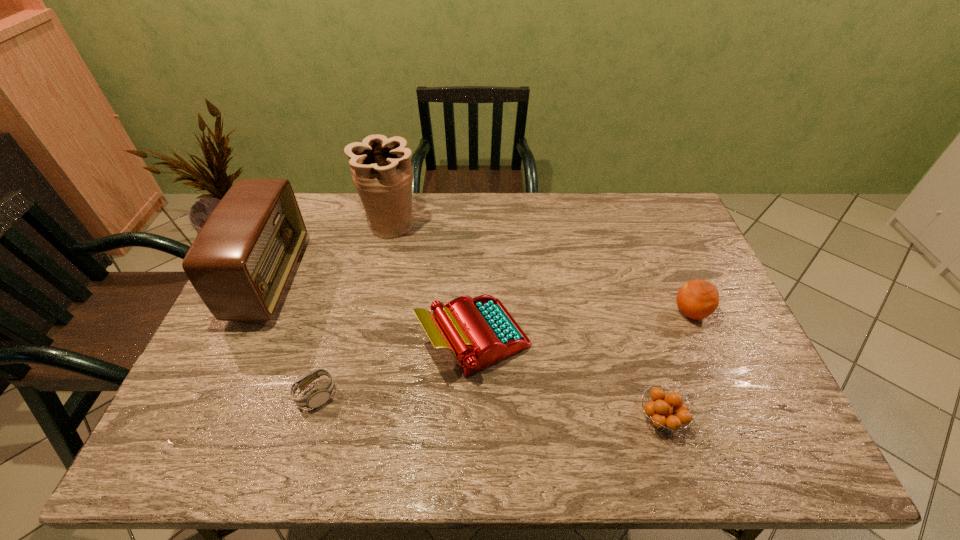
Find the location of a particular element. This screenshot has width=960, height=540. vacant area located on the front-facing side of the radio receiver is located at coordinates (321, 279).

The height and width of the screenshot is (540, 960). Identify the location of vacant position located on the typing side of the third tallest object. (592, 339).

Identify the location of vacant point located 0.310m on the left of the taller orange fruit. This screenshot has height=540, width=960. (564, 312).

Where is `vacant space located 0.390m on the back of the left orange fruit`? This screenshot has width=960, height=540. vacant space located 0.390m on the back of the left orange fruit is located at coordinates (619, 282).

This screenshot has width=960, height=540. Identify the location of free space located 0.100m on the face of the watch. (374, 395).

You are a GUI agent. You are given a task and a screenshot of the screen. Output one action in this format:
    pyautogui.click(x=<x>, y=<y>)
    Task: Click on the object at the far edge
    Image resolution: width=960 pixels, height=540 pixels.
    Given the screenshot: What is the action you would take?
    pyautogui.click(x=381, y=169)

Image resolution: width=960 pixels, height=540 pixels. I want to click on object that is positioned at the near edge, so click(662, 415).

This screenshot has height=540, width=960. In order to click on object that is at the left edge in this screenshot , I will do `click(240, 263)`.

Identify the location of object that is at the right edge. The width and height of the screenshot is (960, 540). (697, 299).

In the image, there is a desktop. Identify the location of vacant space at the far edge. (350, 226).